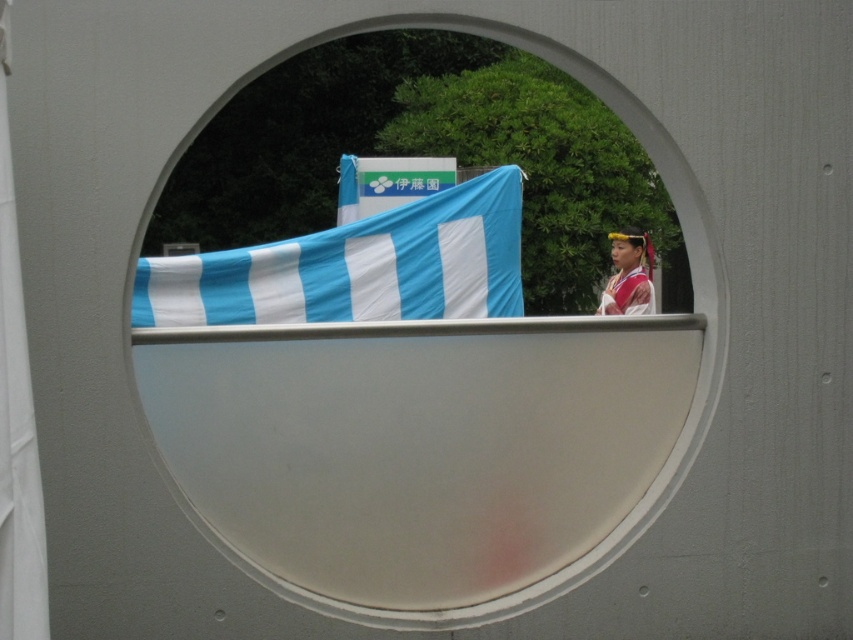
Who is shorter, blue/white striped fabric at center or silk-like pink dress at center?

Standing shorter between the two is silk-like pink dress at center.

Does blue/white striped fabric at center have a lesser width compared to silk-like pink dress at center?

No, blue/white striped fabric at center is not thinner than silk-like pink dress at center.

This screenshot has width=853, height=640. What do you see at coordinates (357, 268) in the screenshot? I see `blue/white striped fabric at center` at bounding box center [357, 268].

Identify the location of blue/white striped fabric at center. (357, 268).

Can you confirm if blue/white striped fabric at center is wider than white fabric curtain at left?

Indeed, blue/white striped fabric at center has a greater width compared to white fabric curtain at left.

Is blue/white striped fabric at center positioned before white fabric curtain at left?

No, it is not.

Is point (498, 253) closer to viewer compared to point (44, 529)?

No, it is behind (44, 529).

Find the location of a particular element. Image resolution: width=853 pixels, height=640 pixels. blue/white striped fabric at center is located at coordinates (357, 268).

Does white matte oval at center have a lesser height compared to white fabric curtain at left?

In fact, white matte oval at center may be taller than white fabric curtain at left.

The width and height of the screenshot is (853, 640). I want to click on white matte oval at center, so click(444, 433).

Locate an element on the screen. This screenshot has height=640, width=853. white matte oval at center is located at coordinates (444, 433).

Locate an element on the screen. white matte oval at center is located at coordinates pos(444,433).